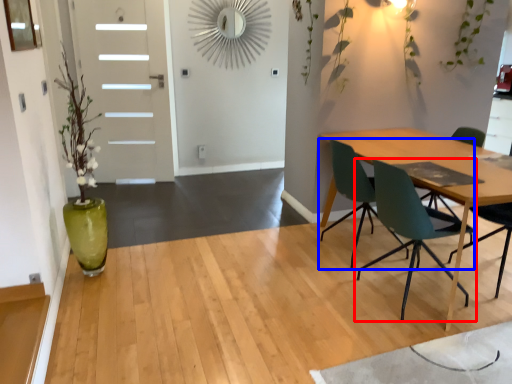
Question: Which object appears farthest to the camera in this image, chair (highlighted by a red box) or chair (highlighted by a blue box)?

Choices:
 (A) chair
 (B) chair

Answer: (B)